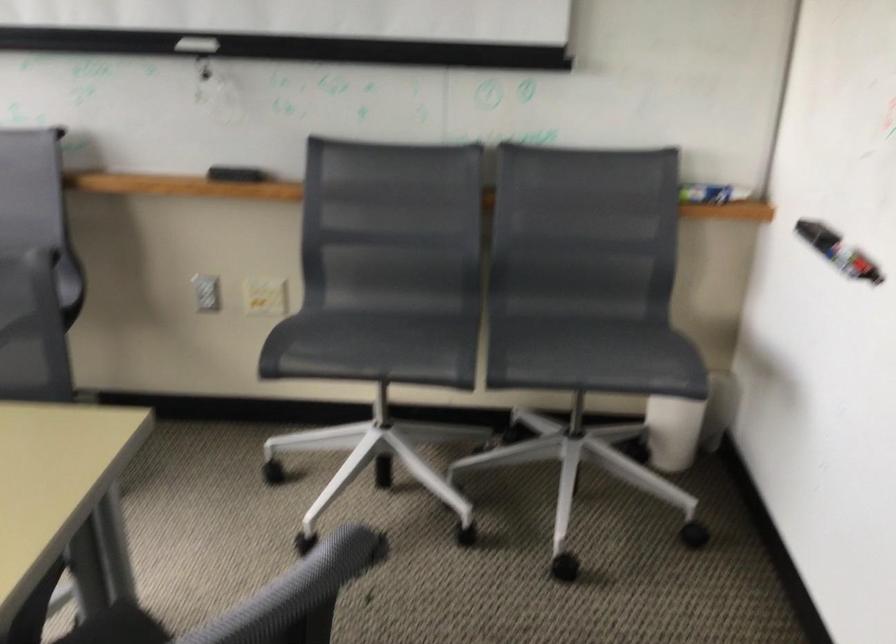
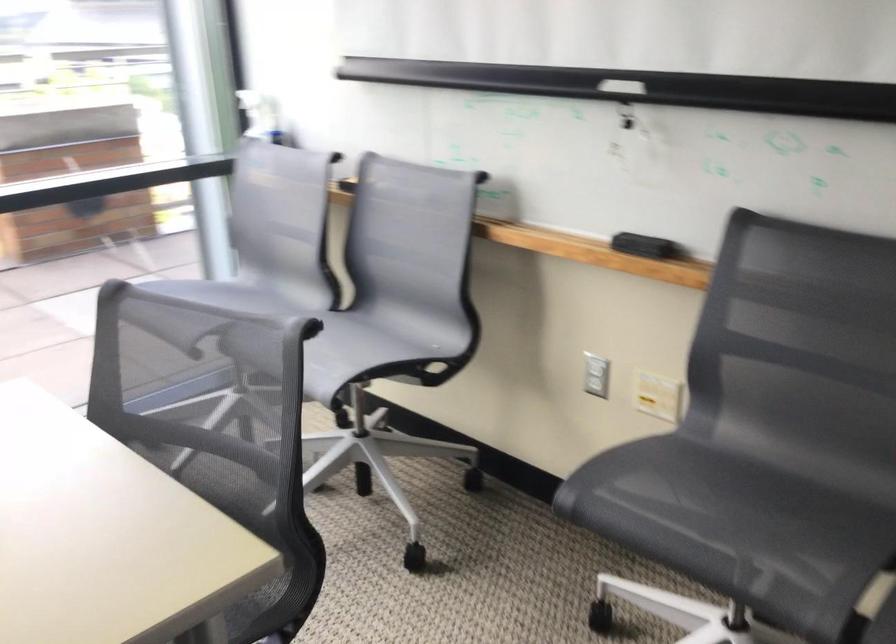
Question: The camera is either moving clockwise (left) or counter-clockwise (right) around the object. The first image is from the beginning of the video and the second image is from the end. Is the camera moving left or right when shooting the video?

Choices:
 (A) Left
 (B) Right

Answer: (B)